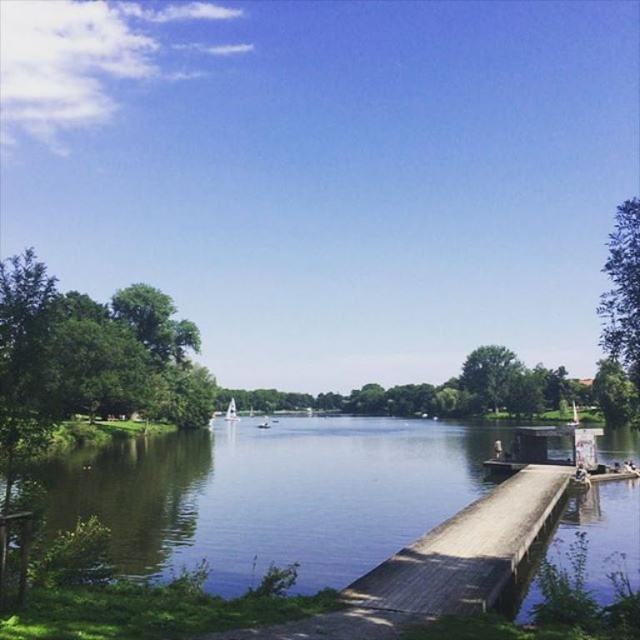
Question: Does smooth brown water at center have a smaller size compared to wooden dock at lower right?

Choices:
 (A) yes
 (B) no

Answer: (B)

Question: From the image, what is the correct spatial relationship of smooth brown water at center in relation to white glossy sailboat at center?

Choices:
 (A) below
 (B) above

Answer: (B)

Question: In this image, where is smooth brown water at center located relative to white glossy sailboat at center?

Choices:
 (A) above
 (B) below

Answer: (A)

Question: Which point is closer to the camera taking this photo?

Choices:
 (A) (541, 483)
 (B) (227, 403)
 (C) (294, 518)

Answer: (C)

Question: Among these objects, which one is nearest to the camera?

Choices:
 (A) smooth brown water at center
 (B) wooden dock at lower right
 (C) white glossy sailboat at center

Answer: (B)

Question: Which of the following is the closest to the observer?

Choices:
 (A) (298, 486)
 (B) (234, 419)
 (C) (387, 628)

Answer: (C)